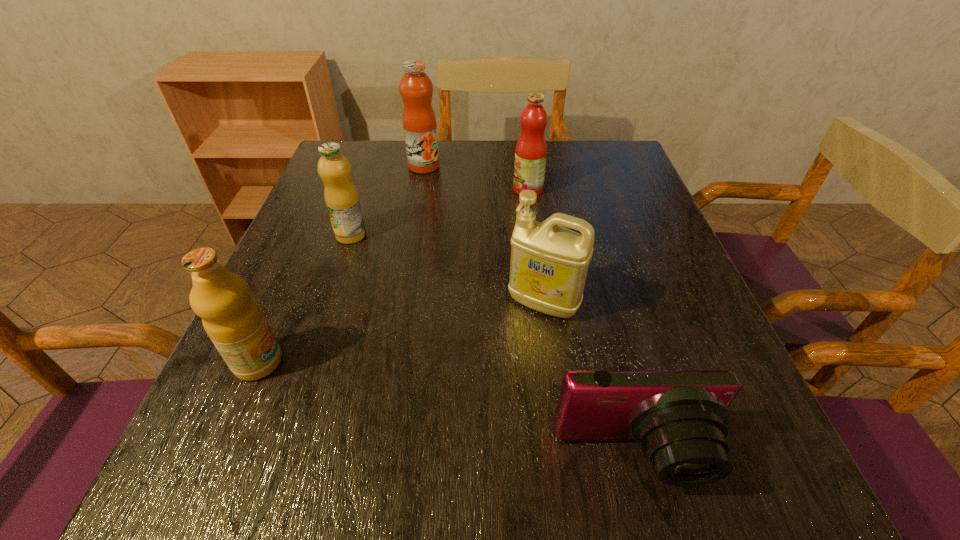
The image size is (960, 540). I want to click on the farthest object, so click(x=416, y=88).

Locate an element on the screen. The image size is (960, 540). the third fruit juice from left to right is located at coordinates (416, 88).

The height and width of the screenshot is (540, 960). In order to click on the second farthest fruit juice in this screenshot , I will do `click(531, 149)`.

This screenshot has width=960, height=540. I want to click on the rightmost fruit juice, so click(531, 149).

Identify the location of the leftmost fruit juice. (233, 320).

The image size is (960, 540). What are the coordinates of `the leftmost object` in the screenshot? It's located at (233, 320).

This screenshot has width=960, height=540. What are the coordinates of `detergent` in the screenshot? It's located at (549, 263).

What are the coordinates of `the second object from left to right` in the screenshot? It's located at (341, 197).

The height and width of the screenshot is (540, 960). Identify the location of the third fruit juice from right to left. (341, 197).

I want to click on camera, so click(x=680, y=417).